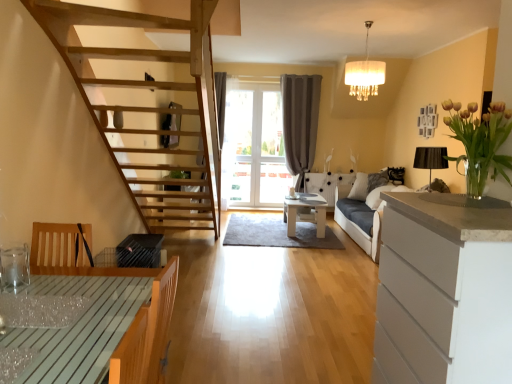
Find the location of a particular element. This screenshot has width=512, height=384. vacant region above wooden table at lower left, the first table positioned from the left (from a real-world perspective) is located at coordinates (57, 305).